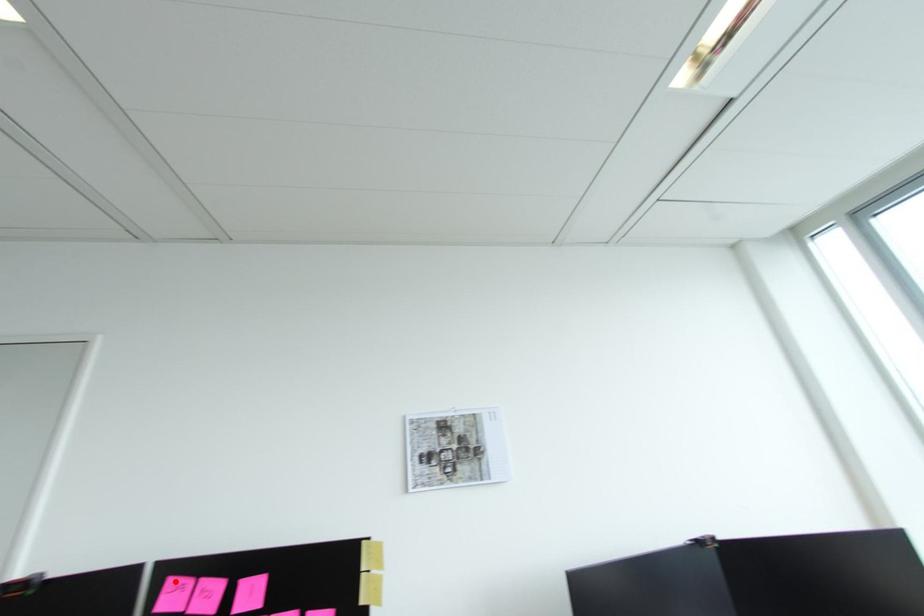
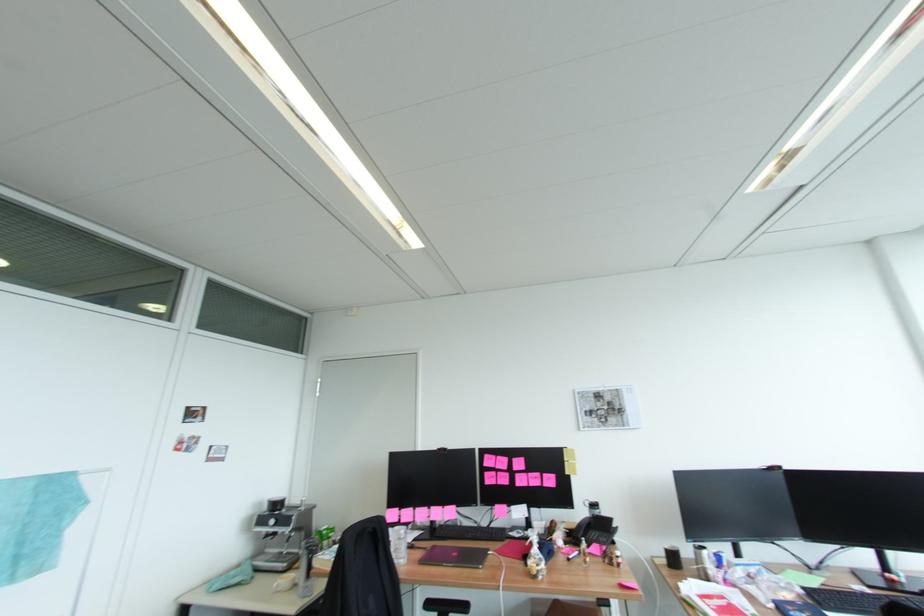
Locate, in the second image, the point that corresponds to the highlighted location in the first image.

(492, 456)